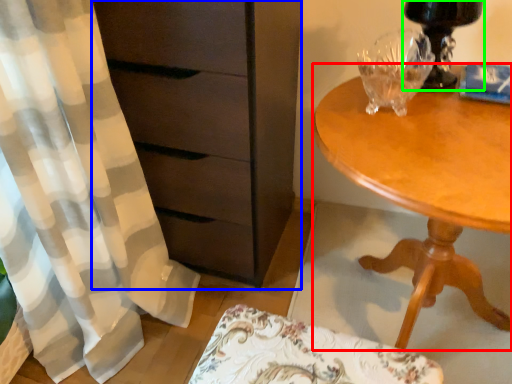
Question: Which object is the closest to the desk (highlighted by a red box)? Choose among these: chest of drawers (highlighted by a blue box) or table lamp (highlighted by a green box).

Choices:
 (A) chest of drawers
 (B) table lamp

Answer: (B)